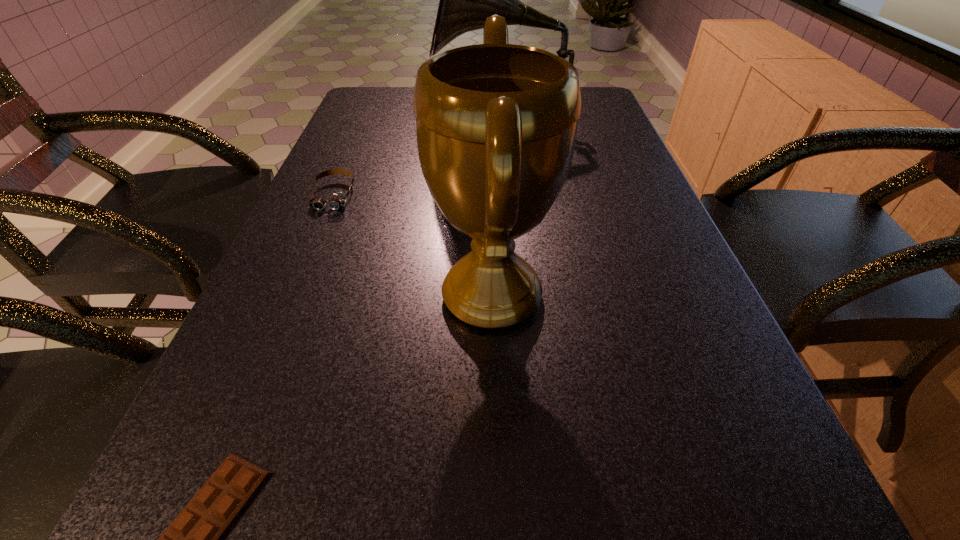
Find the location of `free space located 0.130m on the front of the third farthest object with the decoration`. free space located 0.130m on the front of the third farthest object with the decoration is located at coordinates (359, 295).

Locate an element on the screen. The image size is (960, 540). vacant space located on the front-facing side of the second shortest object is located at coordinates (271, 345).

Where is `object located in the far edge section of the desktop`? object located in the far edge section of the desktop is located at coordinates (466, 0).

What are the coordinates of `object present at the left edge` in the screenshot? It's located at (337, 200).

At what (x,y) coordinates should I click in order to perform the action: click on object that is at the right edge. Please return your answer as a coordinate pair (x, y). The image size is (960, 540). Looking at the image, I should click on (466, 0).

Locate an element on the screen. The height and width of the screenshot is (540, 960). object situated at the far right corner is located at coordinates (466, 0).

This screenshot has width=960, height=540. What are the coordinates of `free space at the left edge of the desktop` in the screenshot? It's located at (372, 145).

At what (x,y) coordinates should I click in order to perform the action: click on free region at the right edge of the desktop. Please return your answer as a coordinate pair (x, y). This screenshot has height=540, width=960. Looking at the image, I should click on (602, 125).

In the image, there is a desktop. Where is `vacant region at the far right corner`? The width and height of the screenshot is (960, 540). vacant region at the far right corner is located at coordinates (598, 112).

Where is `free spot between the third farthest object and the goggles`? The image size is (960, 540). free spot between the third farthest object and the goggles is located at coordinates (413, 245).